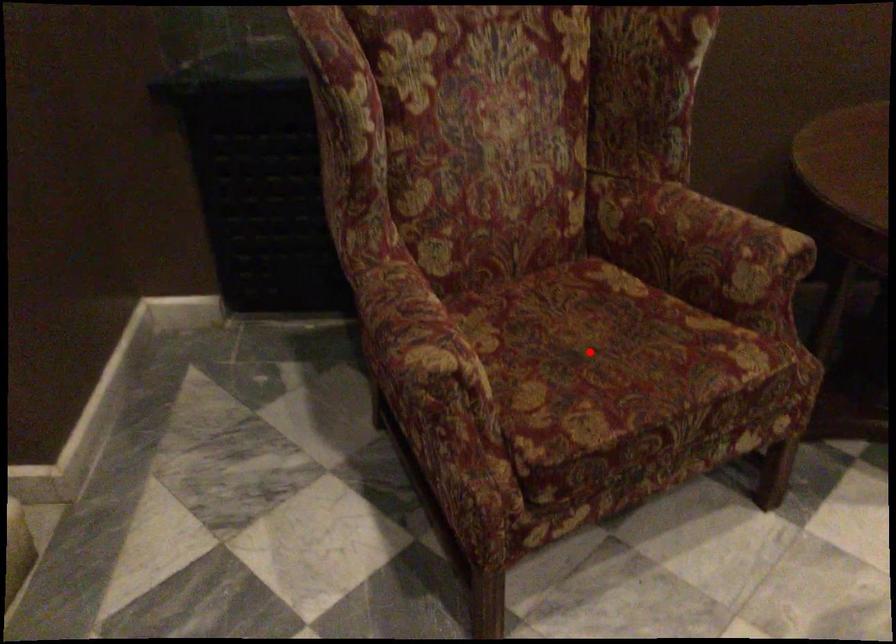
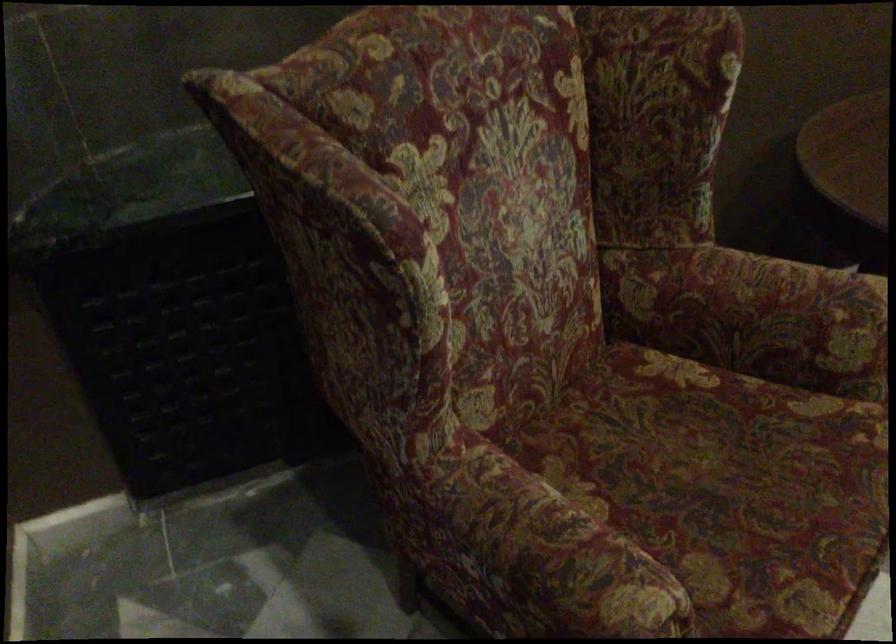
Question: I am providing you with two images of the same scene from different viewpoints. Given a red point in image1, look at the same physical point in image2. Is it:

Choices:
 (A) Closer to the viewpoint
 (B) Farther from the viewpoint

Answer: (A)